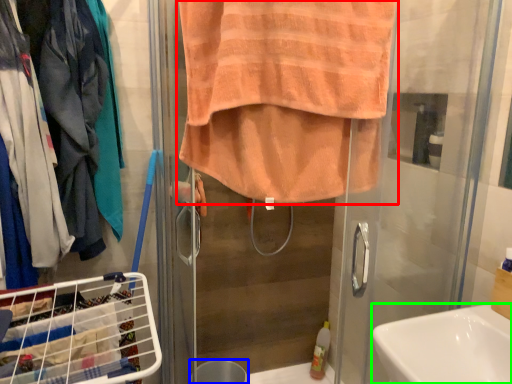
Question: Which is farther away from towel (highlighted by a red box)? trash bin/can (highlighted by a blue box) or sink (highlighted by a green box)?

Choices:
 (A) trash bin/can
 (B) sink

Answer: (A)